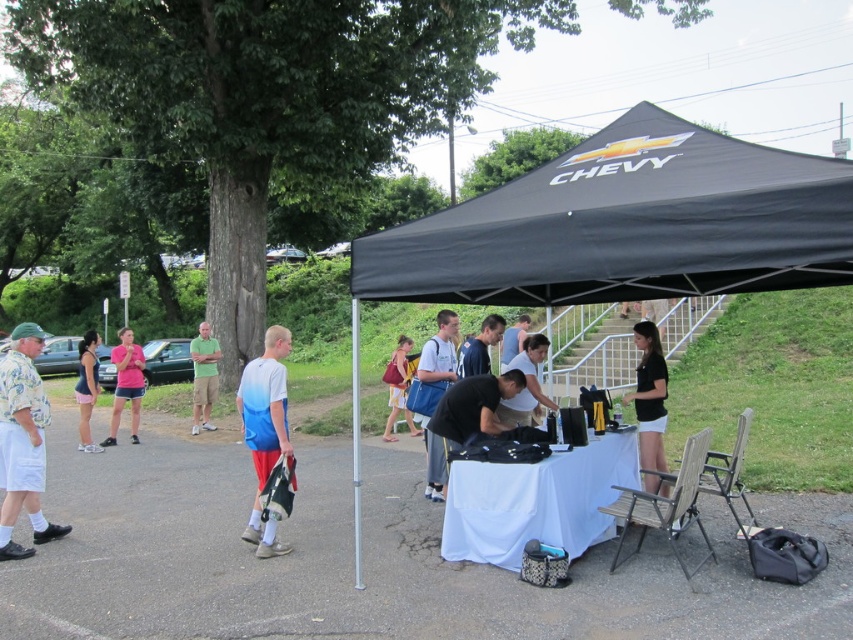
Between white cloth table at center and matte pink shirt at center, which one has more height?

Standing taller between the two is matte pink shirt at center.

Is white cloth table at center to the right of matte pink shirt at center from the viewer's perspective?

Indeed, white cloth table at center is positioned on the right side of matte pink shirt at center.

Between point (457, 464) and point (119, 374), which one is positioned in front?

Positioned in front is point (457, 464).

Image resolution: width=853 pixels, height=640 pixels. I want to click on white cloth table at center, so click(x=537, y=500).

Is black fabric canopy at center thinner than blue fabric backpack at center?

Incorrect, black fabric canopy at center's width is not less than blue fabric backpack at center's.

Can you confirm if black fabric canopy at center is positioned below blue fabric backpack at center?

Actually, black fabric canopy at center is above blue fabric backpack at center.

The image size is (853, 640). What do you see at coordinates (625, 225) in the screenshot? I see `black fabric canopy at center` at bounding box center [625, 225].

Find the location of `black fabric canopy at center`. black fabric canopy at center is located at coordinates click(x=625, y=225).

Does matte pink shirt at center lie behind matte pink shorts at lower left?

Yes.

Which is in front, point (103, 442) or point (91, 356)?

Point (91, 356) is in front.

Locate an element on the screen. Image resolution: width=853 pixels, height=640 pixels. matte pink shirt at center is located at coordinates (126, 385).